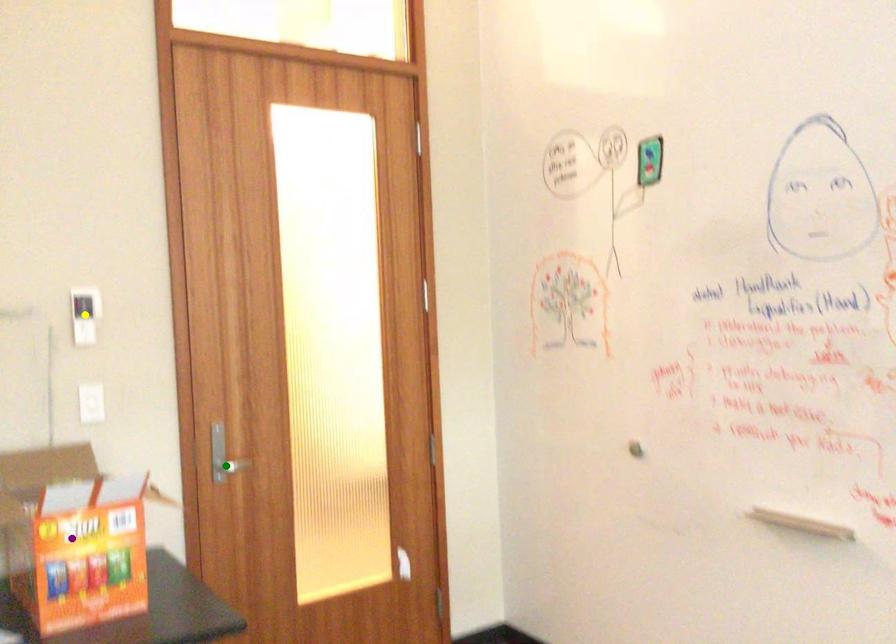
Order these from nearest to farthest:
green point, purple point, yellow point

purple point → yellow point → green point